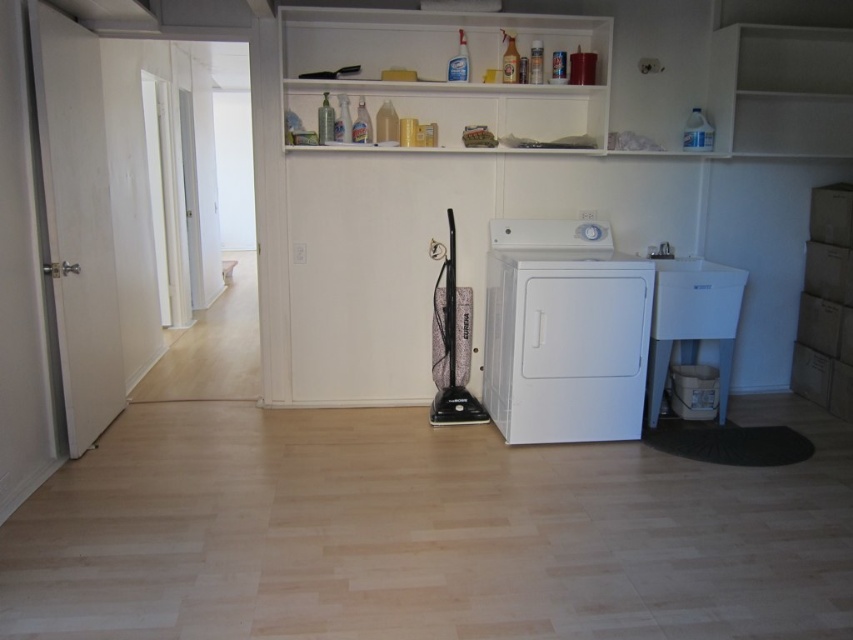
Is white matte washing machine at center thinner than white matte shelf at upper center?

Yes, white matte washing machine at center is thinner than white matte shelf at upper center.

Is white matte washing machine at center above white matte shelf at upper center?

Incorrect, white matte washing machine at center is not positioned above white matte shelf at upper center.

Does point (590, 376) come farther from viewer compared to point (529, 128)?

No, it is in front of (529, 128).

At what (x,y) coordinates should I click in order to perform the action: click on white matte washing machine at center. Please return your answer as a coordinate pair (x, y). Image resolution: width=853 pixels, height=640 pixels. Looking at the image, I should click on (564, 332).